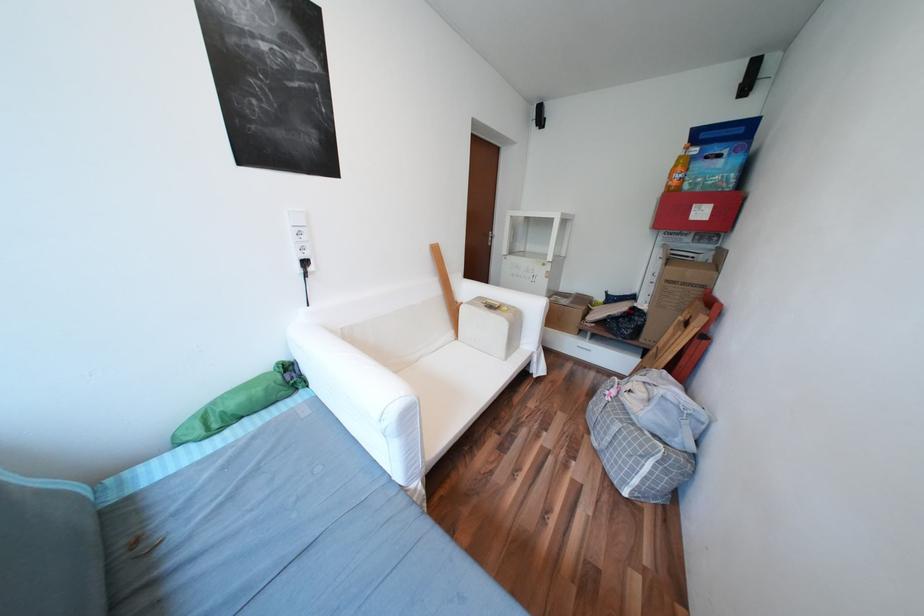
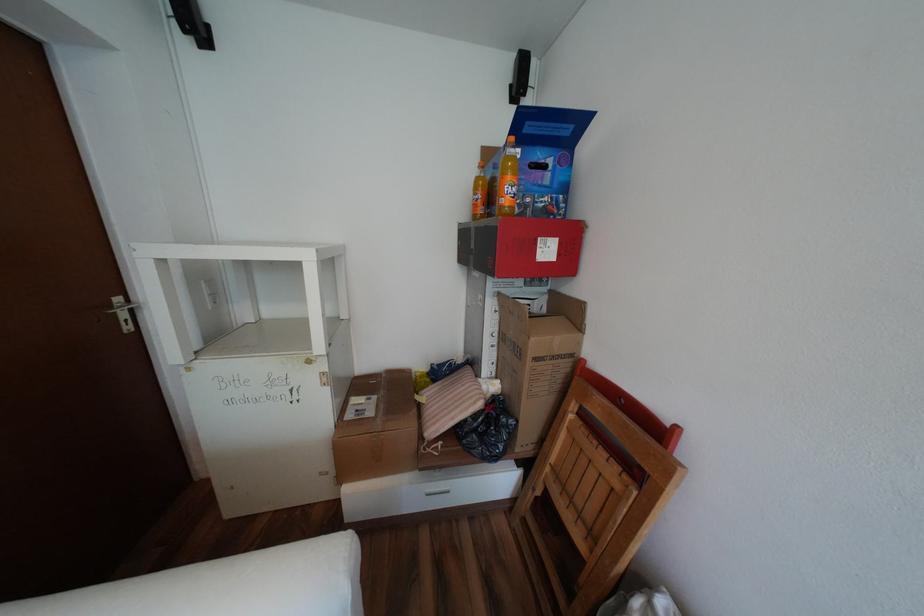
Find the pixel in the second image that matches [711,213] in the first image.

(556, 251)